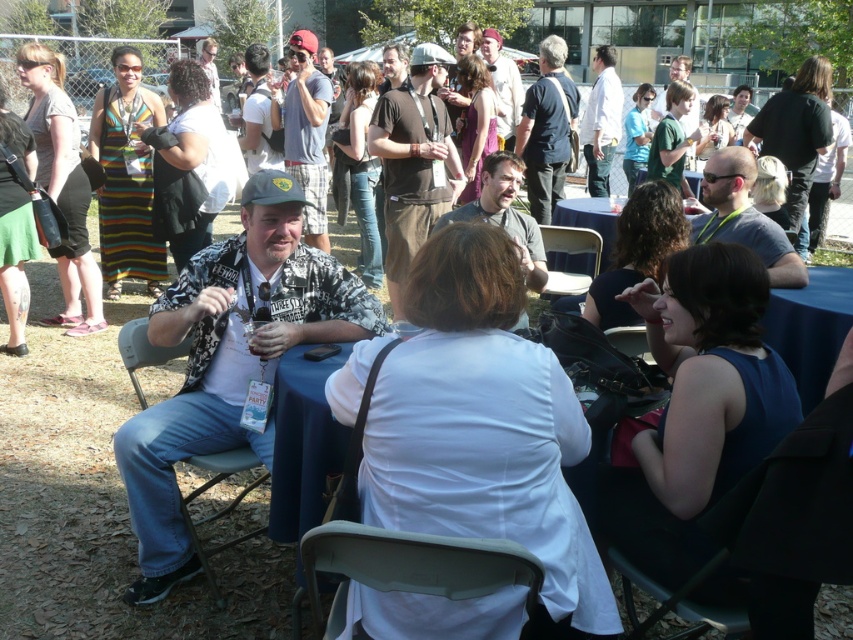
Is blue fabric table at lower right taller than green fabric shirt at upper center?

In fact, blue fabric table at lower right may be shorter than green fabric shirt at upper center.

Between blue fabric table at lower right and green fabric shirt at upper center, which one appears on the right side from the viewer's perspective?

green fabric shirt at upper center is more to the right.

What do you see at coordinates (810, 326) in the screenshot? I see `blue fabric table at lower right` at bounding box center [810, 326].

At what (x,y) coordinates should I click in order to perform the action: click on blue fabric table at lower right. Please return your answer as a coordinate pair (x, y). The height and width of the screenshot is (640, 853). Looking at the image, I should click on (810, 326).

Where is `dark brown leather jacket at center`? The image size is (853, 640). dark brown leather jacket at center is located at coordinates (x=505, y=212).

Who is positioned more to the left, dark brown leather jacket at center or green fabric shirt at upper center?

From the viewer's perspective, dark brown leather jacket at center appears more on the left side.

Who is more distant from viewer, (514,172) or (697,124)?

The point (697,124) is more distant.

You are a GUI agent. You are given a task and a screenshot of the screen. Output one action in this format:
    pyautogui.click(x=<x>, y=<y>)
    Task: Click on the dark brown leather jacket at center
    Image resolution: width=853 pixels, height=640 pixels.
    Given the screenshot: What is the action you would take?
    pyautogui.click(x=505, y=212)

Does dark gray t-shirt at center come in front of green fabric shirt at upper center?

Yes.

Does dark gray t-shirt at center have a greater height compared to green fabric shirt at upper center?

No.

Describe the element at coordinates (743, 218) in the screenshot. The image size is (853, 640). I see `dark gray t-shirt at center` at that location.

Where is `dark gray t-shirt at center`? This screenshot has height=640, width=853. dark gray t-shirt at center is located at coordinates (743, 218).